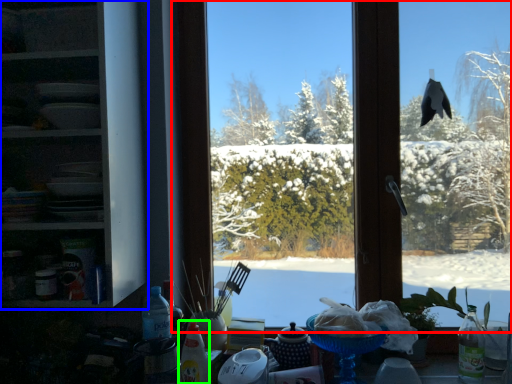
Question: Considering the real-world distances, which object is farthest from window (highlighted by a red box)? shelf (highlighted by a blue box) or bottle (highlighted by a green box)?

Choices:
 (A) shelf
 (B) bottle

Answer: (B)